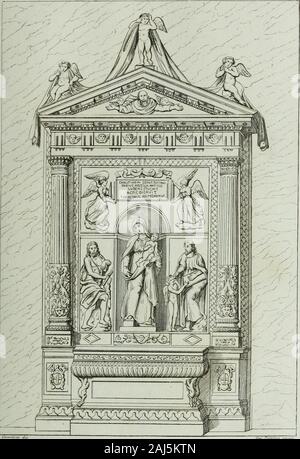
In order to click on decorative edge in this screenshot , I will do `click(63, 408)`, `click(105, 416)`, `click(145, 414)`, `click(234, 411)`.